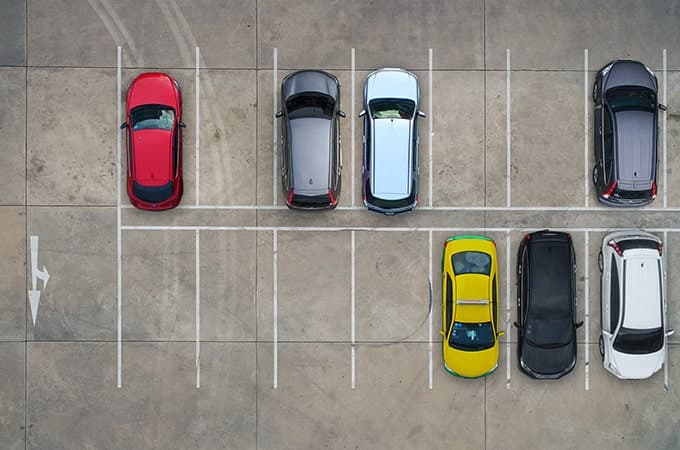
Locate an element on the screen. This screenshot has width=680, height=450. hood is located at coordinates (154, 88), (311, 82), (396, 82), (629, 73), (636, 363), (556, 361), (462, 363).